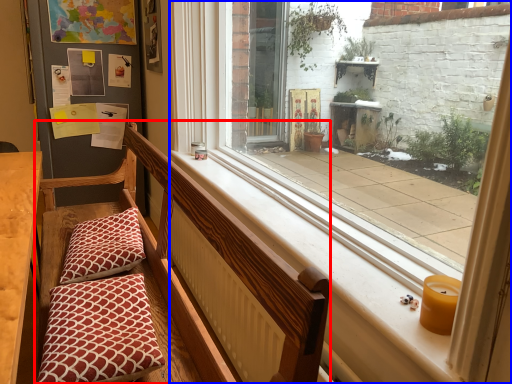
Question: Which object is further to the camera taking this photo, church bench (highlighted by a red box) or window (highlighted by a blue box)?

Choices:
 (A) church bench
 (B) window

Answer: (B)